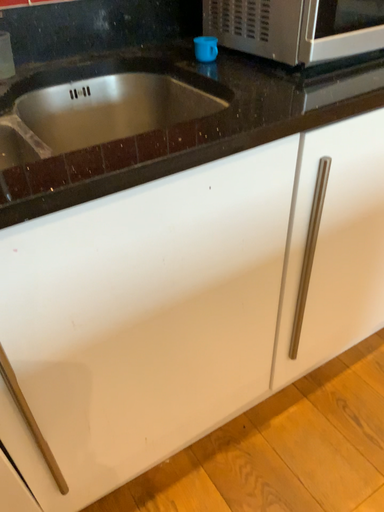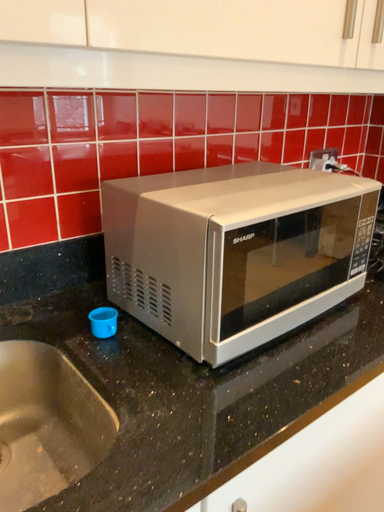
Question: How did the camera likely rotate when shooting the video?

Choices:
 (A) rotated upward
 (B) rotated downward

Answer: (A)